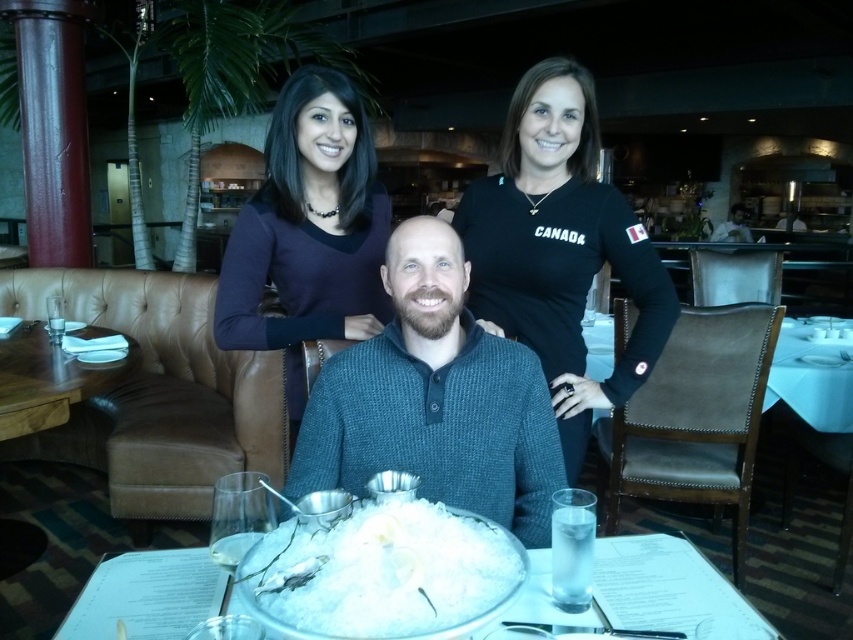
Question: Which of the following is the farthest from the observer?

Choices:
 (A) (740, 220)
 (B) (645, 605)
 (C) (413, 547)
 (D) (306, 209)

Answer: (A)

Question: Considering the relative positions of teal knitted sweater at center and purple matte sweater at upper left in the image provided, where is teal knitted sweater at center located with respect to purple matte sweater at upper left?

Choices:
 (A) below
 (B) above

Answer: (A)

Question: Which point appears closest to the camera in this image?

Choices:
 (A) (235, 272)
 (B) (680, 618)

Answer: (B)

Question: Considering the relative positions of teal knitted sweater at center and purple matte sweater at upper left in the image provided, where is teal knitted sweater at center located with respect to purple matte sweater at upper left?

Choices:
 (A) left
 (B) right

Answer: (B)

Question: Can you confirm if black jersey at upper right is smaller than smooth white shirt at center?

Choices:
 (A) no
 (B) yes

Answer: (A)

Question: Which object is closer to the camera taking this photo?

Choices:
 (A) smooth white shirt at center
 (B) brown wooden table at left
 (C) black jersey at upper right
 (D) white frosted plate at center

Answer: (D)